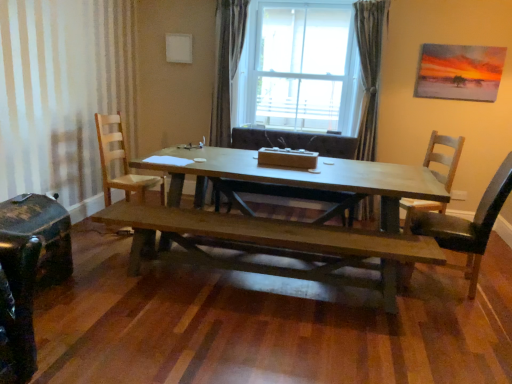
Question: Considering the relative positions of wooden chair at right, which is counted as the third chair, starting from the left, and light brown wooden chair at left, marked as the fourth chair in a right-to-left arrangement, in the image provided, is wooden chair at right, which is counted as the third chair, starting from the left, to the left or to the right of light brown wooden chair at left, marked as the fourth chair in a right-to-left arrangement,?

Choices:
 (A) right
 (B) left

Answer: (A)

Question: In terms of size, does wooden chair at right, the 2th chair when ordered from right to left, appear bigger or smaller than light brown wooden chair at left, marked as the fourth chair in a right-to-left arrangement?

Choices:
 (A) small
 (B) big

Answer: (B)

Question: Which object is positioned closest to the wooden table at center?

Choices:
 (A) shiny black suitcase at lower left
 (B) wooden chair at right, which is counted as the third chair, starting from the left
 (C) light brown wooden chair at left, marked as the fourth chair in a right-to-left arrangement
 (D) satin fabric curtain at center, which is the first curtain in left-to-right order
 (E) transparent glass window at center

Answer: (C)

Question: Which is farther from the satin fabric curtain at upper center, the 1th curtain in the right-to-left sequence?

Choices:
 (A) light brown wooden chair at left, acting as the 1th chair starting from the left
 (B) transparent glass window at center
 (C) satin fabric curtain at center, which is the first curtain in left-to-right order
 (D) dark brown wooden bench at center
 (E) light brown wood chair at right, which is the first chair from right to left

Answer: (A)